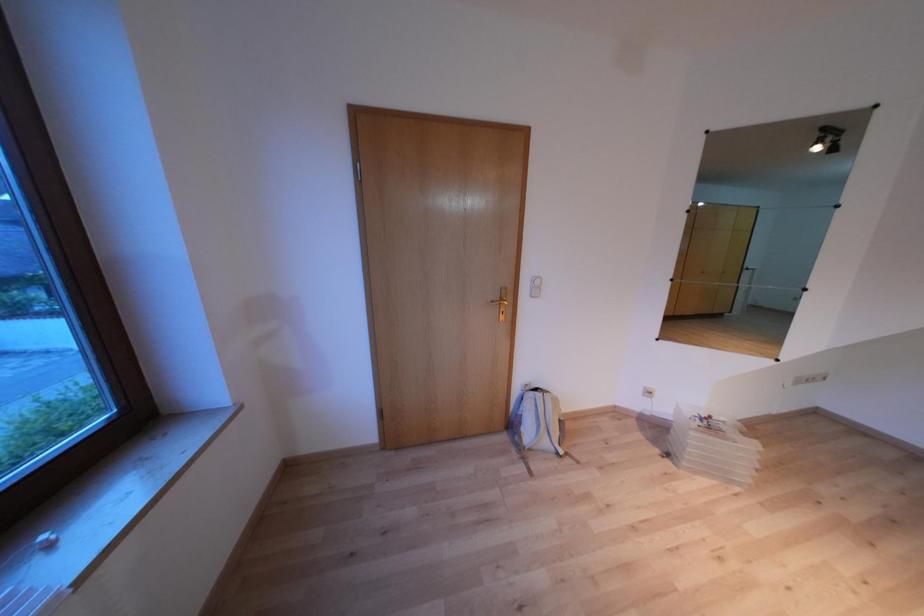
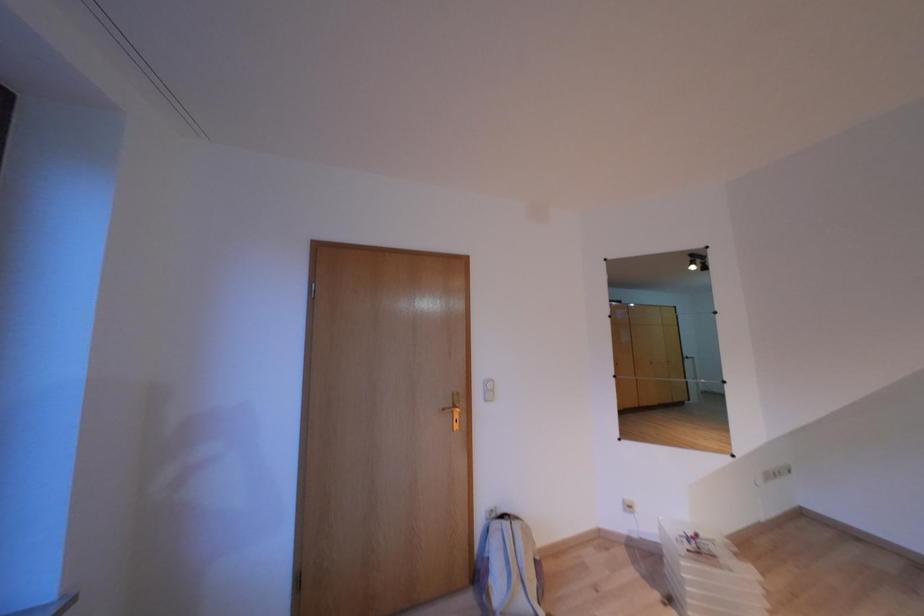
The images are taken continuously from a first-person perspective. In which direction are you moving?

The movement direction of the cameraman is right, backward.